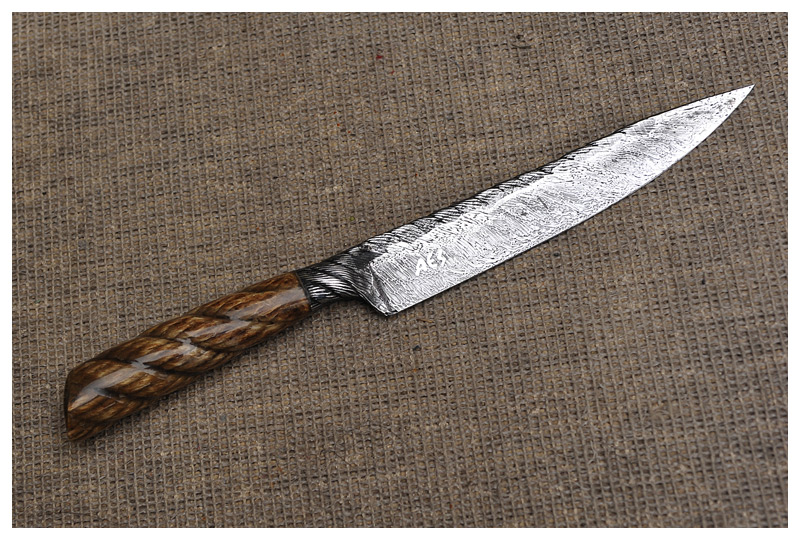
At what (x,y) coordinates should I click in order to perform the action: click on brown handle. Please return your answer as a coordinate pair (x, y). Looking at the image, I should click on (185, 334).